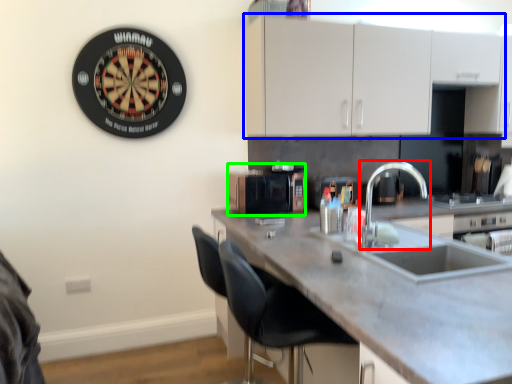
Question: Which is nearer to the tap (highlighted by a red box)? cabinetry (highlighted by a blue box) or appliance (highlighted by a green box).

Choices:
 (A) cabinetry
 (B) appliance

Answer: (B)